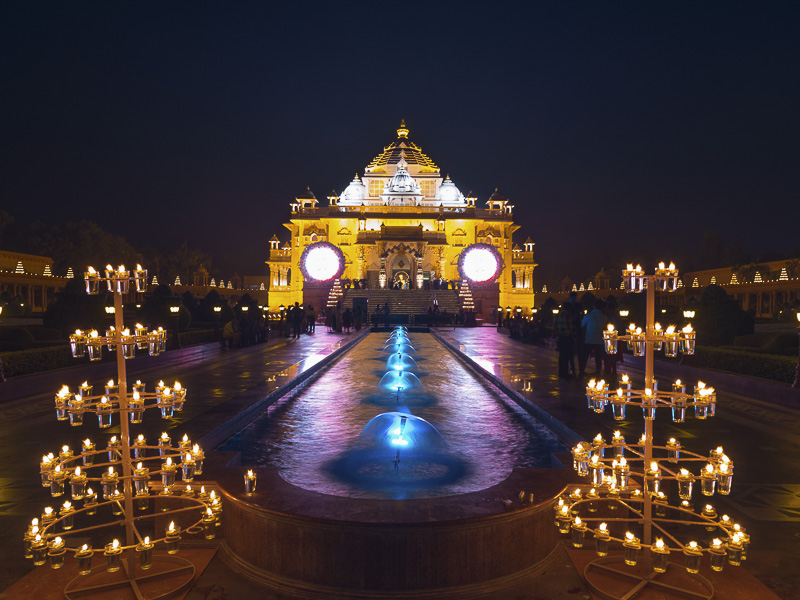
Find the location of a particular element. This screenshot has width=800, height=600. different rows of candles is located at coordinates (101, 542), (108, 480), (118, 404), (104, 340), (118, 277), (642, 279), (650, 337), (646, 396), (629, 477), (650, 538).